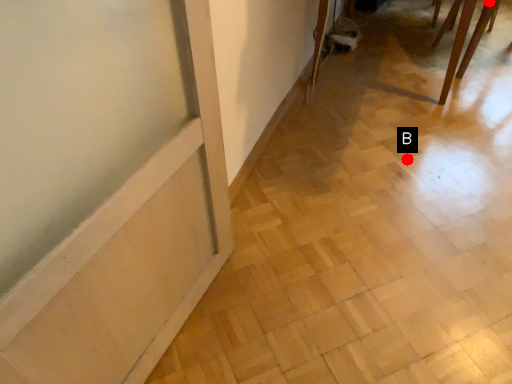
Question: Two points are circled on the image, labeled by A and B beside each circle. Which point is closer to the camera taking this photo?

Choices:
 (A) A is closer
 (B) B is closer

Answer: (B)